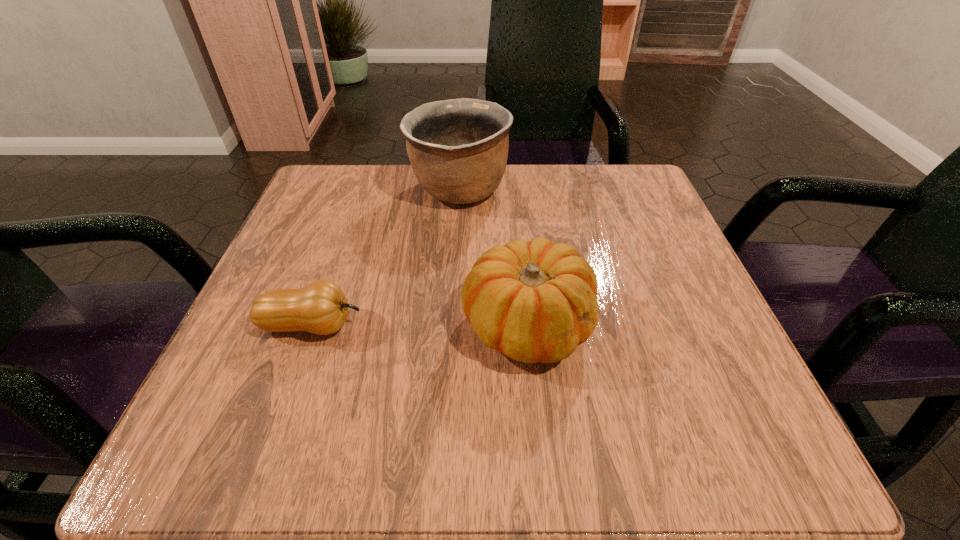
At what (x,y) coordinates should I click in order to perform the action: click on the tallest object. Please return your answer as a coordinate pair (x, y). The image size is (960, 540). Looking at the image, I should click on (458, 148).

Locate an element on the screen. The image size is (960, 540). pottery is located at coordinates (458, 148).

The height and width of the screenshot is (540, 960). What are the coordinates of `the second tallest object` in the screenshot? It's located at (535, 301).

The image size is (960, 540). Identify the location of the right gourd. (535, 301).

Where is `the shortest object`? This screenshot has height=540, width=960. the shortest object is located at coordinates (321, 307).

Locate an element on the screen. This screenshot has width=960, height=540. the shorter gourd is located at coordinates (321, 307).

Identify the location of blank space located 0.080m on the front of the tallest object. (456, 247).

Locate an element on the screen. The width and height of the screenshot is (960, 540). vacant space located 0.130m on the back of the taller gourd is located at coordinates (517, 233).

Identify the location of free space located 0.170m on the stem side of the shorter gourd. (474, 325).

Where is `object at the far edge`? The width and height of the screenshot is (960, 540). object at the far edge is located at coordinates (458, 148).